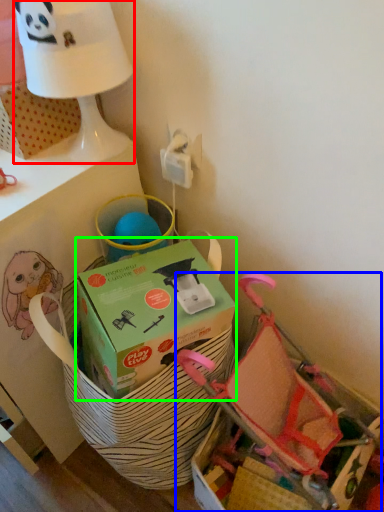
Question: Based on their relative distances, which object is nearer to table lamp (highlighted by a red box)? Choose from baby carriage (highlighted by a blue box) and box (highlighted by a green box).

Choices:
 (A) baby carriage
 (B) box

Answer: (B)